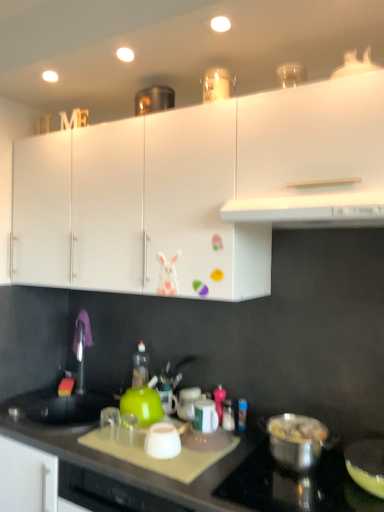
Question: Is black matte countertop at lower center directly adjacent to white glossy jar at center?

Choices:
 (A) no
 (B) yes

Answer: (A)

Question: Is white glossy jar at center located within black matte countertop at lower center?

Choices:
 (A) yes
 (B) no

Answer: (B)

Question: Is black matte countertop at lower center outside white glossy jar at center?

Choices:
 (A) yes
 (B) no

Answer: (A)

Question: Is black matte countertop at lower center at the right side of white glossy jar at center?

Choices:
 (A) yes
 (B) no

Answer: (B)

Question: Is there a large distance between black matte countertop at lower center and white glossy jar at center?

Choices:
 (A) no
 (B) yes

Answer: (A)

Question: Is white matte cabinet at upper center, arranged as the third cabinetry when viewed from the left, in front of or behind white glossy cup at center, which appears as the second kitchen appliance when viewed from the left, in the image?

Choices:
 (A) behind
 (B) front

Answer: (B)

Question: From the image's perspective, is white matte cabinet at upper center, arranged as the 1th cabinetry when viewed from the right, located above or below white glossy cup at center, which appears as the second kitchen appliance when viewed from the left?

Choices:
 (A) above
 (B) below

Answer: (A)

Question: Visually, is white matte cabinet at upper center, arranged as the third cabinetry when viewed from the left, positioned to the left or to the right of white glossy cup at center, which appears as the second kitchen appliance when viewed from the left?

Choices:
 (A) right
 (B) left

Answer: (A)

Question: Based on their sizes in the image, would you say white matte cabinet at upper center, arranged as the third cabinetry when viewed from the left, is bigger or smaller than white glossy cup at center, marked as the 3th kitchen appliance in a right-to-left arrangement?

Choices:
 (A) big
 (B) small

Answer: (A)

Question: From the image's perspective, is shiny metallic pot at lower right, acting as the 4th kitchen appliance starting from the left, positioned above or below stainless steel pot at lower right?

Choices:
 (A) below
 (B) above

Answer: (B)

Question: Considering the positions of shiny metallic pot at lower right, which is the first kitchen appliance from right to left, and stainless steel pot at lower right in the image, is shiny metallic pot at lower right, which is the first kitchen appliance from right to left, taller or shorter than stainless steel pot at lower right?

Choices:
 (A) short
 (B) tall

Answer: (A)

Question: Relative to stainless steel pot at lower right, is shiny metallic pot at lower right, which is the first kitchen appliance from right to left, in front or behind?

Choices:
 (A) behind
 (B) front

Answer: (A)

Question: In the image, is shiny metallic pot at lower right, which is the first kitchen appliance from right to left, on the left side or the right side of stainless steel pot at lower right?

Choices:
 (A) left
 (B) right

Answer: (B)

Question: From a real-world perspective, is shiny metallic pot at lower right, acting as the 4th kitchen appliance starting from the left, positioned above or below white glossy jar at center?

Choices:
 (A) above
 (B) below

Answer: (B)

Question: Is point (322, 430) closer or farther from the camera than point (180, 394)?

Choices:
 (A) closer
 (B) farther

Answer: (A)